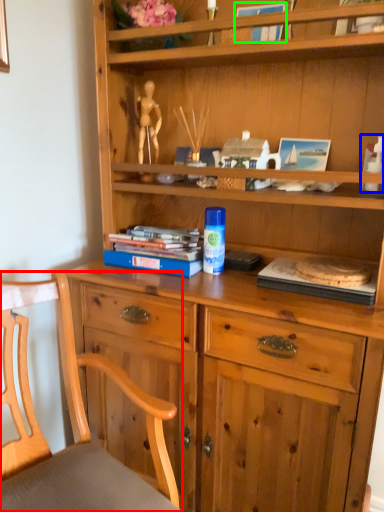
Question: Considering the real-world distances, which object is farthest from chair (highlighted by a red box)? toy (highlighted by a blue box) or book (highlighted by a green box)?

Choices:
 (A) toy
 (B) book

Answer: (B)